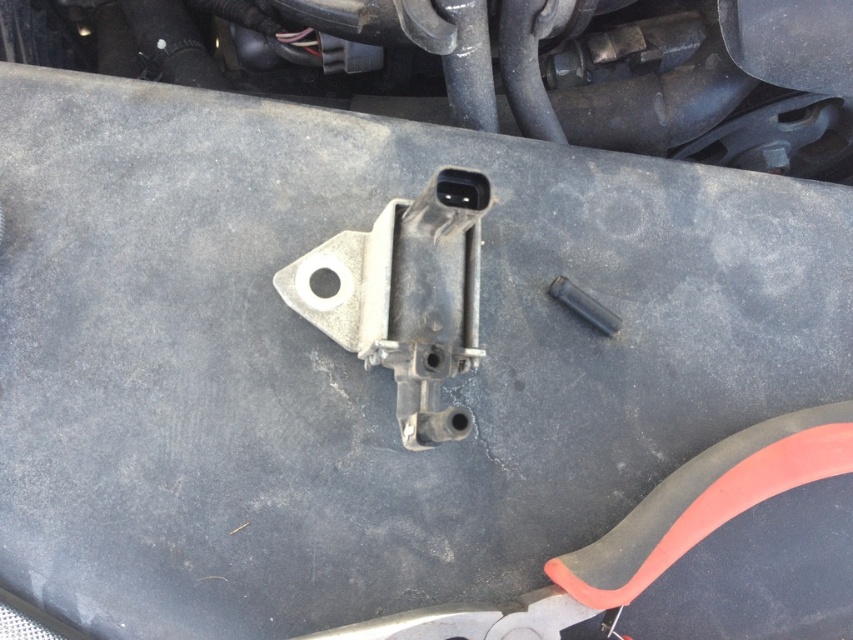
You are a mechanic working on a car engine. You need to reach the metallic gray bracket at center to adjust it. Your tool is 28 inches long. Can you safely adjust it without extending your arm beyond the tool?

The metallic gray bracket at center is 32.13 inches away from the camera. Since your tool is only 28 inches long, you would need to extend your arm to reach it, which may not be safe. Consider using a longer tool or adjusting your position to ensure safety.

You are a technician inspecting the mechanical part in the engine bay. You notice a point labeled as point 1 at coordinates (364,332). The safety protocol requires that any point on the part closer than 40 inches to the camera must be inspected for wear. Is point 1 within the required inspection range?

Point (364,332) is 38.08 inches away from the camera, which is within the 40 inches threshold. Therefore, it must be inspected for wear as per the safety protocol.

You are an engineer inspecting the engine bay. You need to access the black metal bolt at center to tighten it. Is the metallic gray bracket at center blocking your access to it?

→ The metallic gray bracket at center is in front of the black metal bolt at center, so it is blocking access to the bolt.